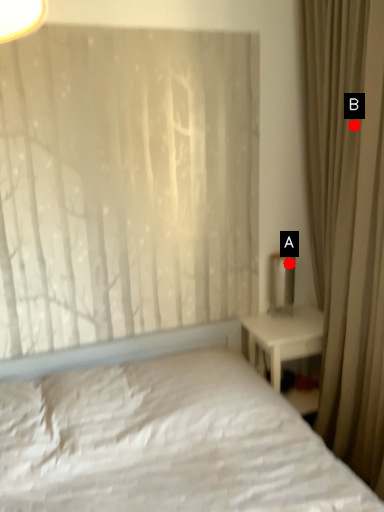
Question: Two points are circled on the image, labeled by A and B beside each circle. Which of the following is the closest to the observer?

Choices:
 (A) A is closer
 (B) B is closer

Answer: (B)